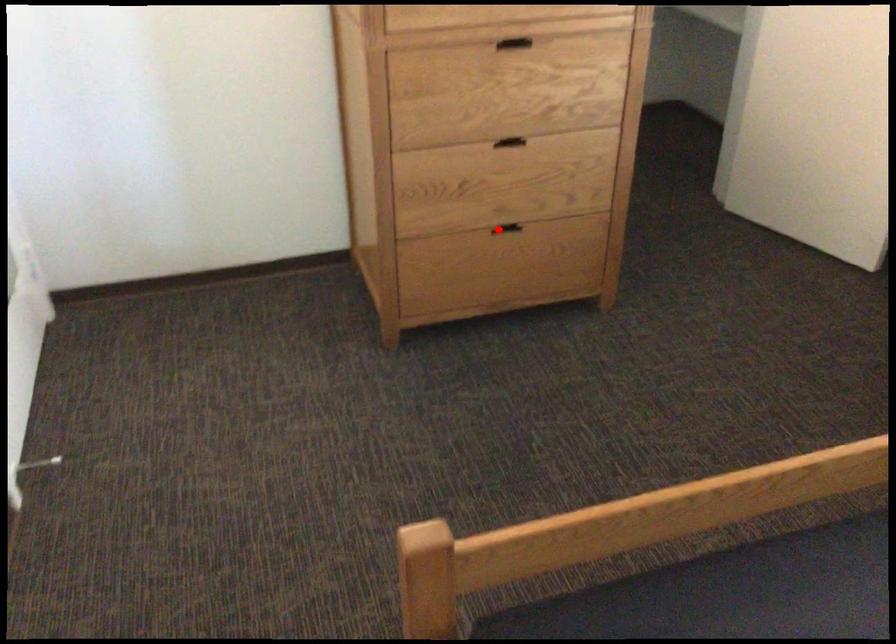
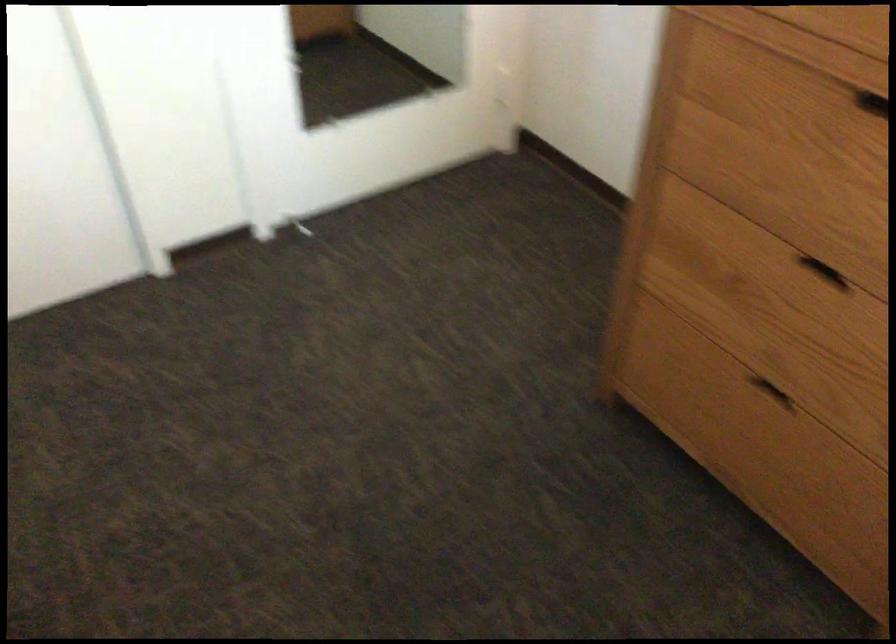
Find the pixel in the second image that matches the highlighted location in the first image.

(770, 392)